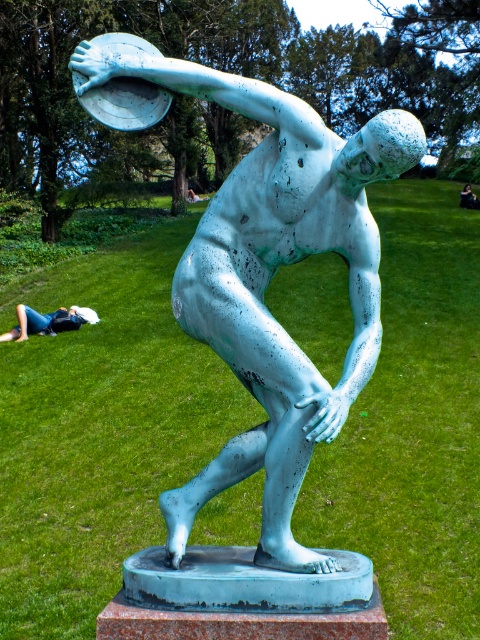
Consider the image. Can you confirm if white fabric at lower left is shorter than black fabric person at lower right?

Yes.

Describe the element at coordinates (48, 321) in the screenshot. I see `white fabric at lower left` at that location.

Find the location of `white fabric at lower left`. white fabric at lower left is located at coordinates (48, 321).

Between green patina statue at center and white fabric at lower left, which one has more height?

Standing taller between the two is white fabric at lower left.

Is green patina statue at center further to the viewer compared to white fabric at lower left?

No.

What do you see at coordinates (269, 276) in the screenshot?
I see `green patina statue at center` at bounding box center [269, 276].

Where is `green patina statue at center`? Image resolution: width=480 pixels, height=640 pixels. green patina statue at center is located at coordinates (269, 276).

Is point (251, 170) closer to camera compared to point (466, 193)?

Yes, point (251, 170) is closer to viewer.

Does green patina statue at center come in front of black fabric person at lower right?

Yes, green patina statue at center is in front of black fabric person at lower right.

Measure the distance between green patina statue at center and camera.

green patina statue at center and camera are 3.25 meters apart.

Find the location of `green patina statue at center`. green patina statue at center is located at coordinates (269, 276).